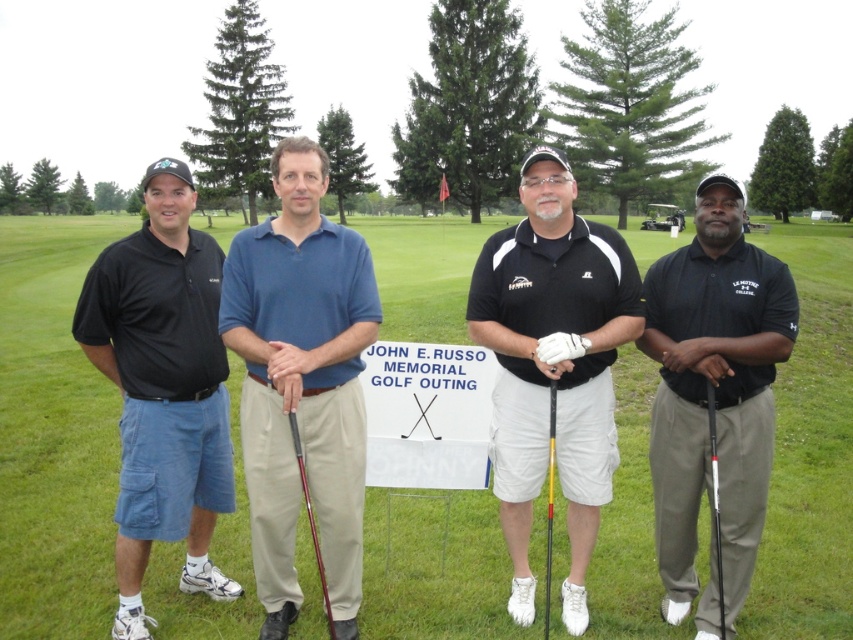
Question: From the image, what is the correct spatial relationship of green grass at center in relation to black cotton polo shirt at left?

Choices:
 (A) below
 (B) above

Answer: (B)

Question: Which of the following is the farthest from the observer?

Choices:
 (A) (717, 524)
 (B) (315, 531)
 (C) (613, 545)

Answer: (C)

Question: Can you confirm if green grass at center is thinner than black matte golf club at right?

Choices:
 (A) no
 (B) yes

Answer: (A)

Question: Which object is positioned closest to the yellow matte golf club at center?

Choices:
 (A) black cotton polo shirt at left
 (B) green grass at center
 (C) black matte golf club at right

Answer: (C)

Question: Which of the following is the closest to the observer?

Choices:
 (A) (592, 224)
 (B) (547, 531)

Answer: (A)

Question: Is black cotton polo shirt at left thinner than black matte golf club at right?

Choices:
 (A) yes
 (B) no

Answer: (B)